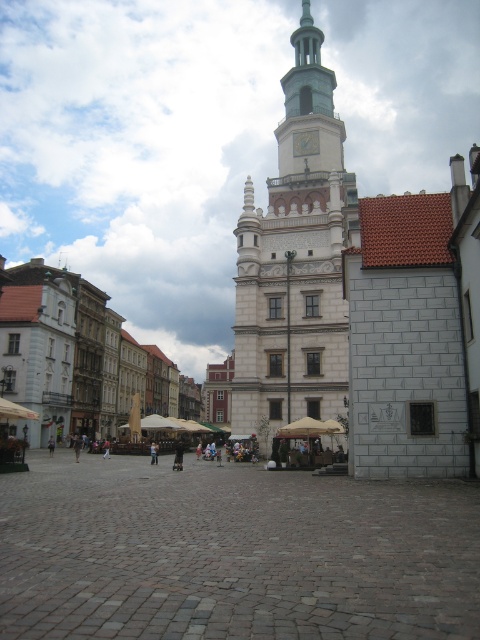
You are standing at the center of the town square and want to visit the white stone building at left. Which direction should you walk to reach it?

Since the white stone building at left is located at coordinates approximately 0.558 on the x axis and 0.169 on the y axis, you should walk towards the left side of the square to reach it.

You are standing in the European town square and want to take a photo of the white stone tower at center and the light brown leather jacket at center. Which object should you focus on first to ensure both are in the frame?

You should focus on the white stone tower at center first because it is in front of the light brown leather jacket at center, so adjusting the camera to include the tower will naturally include the jacket behind it as well.

You are standing in the town square and want to take a photo of both the white stone tower at center and the white stone building at left. Which one should you zoom in on more to ensure both fit in the frame?

Since the white stone tower at center is smaller than the white stone building at left, you should zoom in more on the white stone building at left to ensure both fit in the frame.